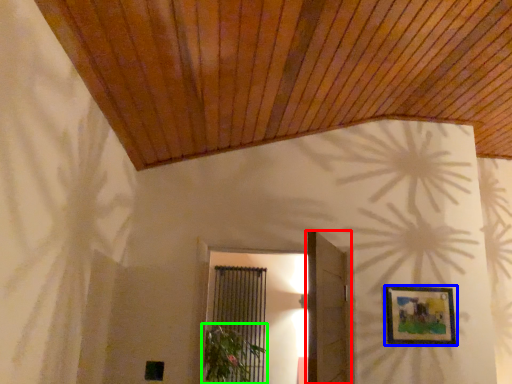
Question: Based on their relative distances, which object is farther from door (highlighted by a red box)? Choose from picture frame (highlighted by a blue box) and plant (highlighted by a green box).

Choices:
 (A) picture frame
 (B) plant

Answer: (B)